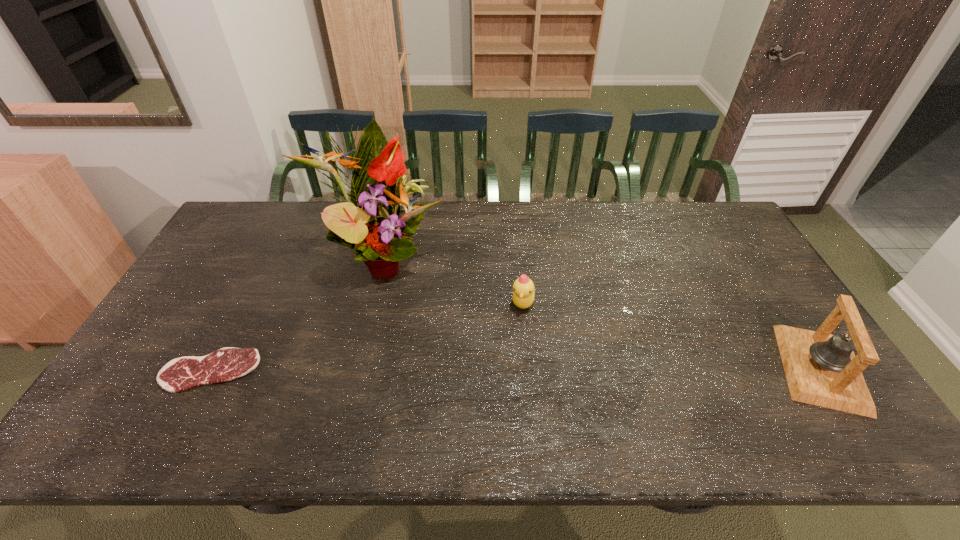
You are a GUI agent. You are given a task and a screenshot of the screen. Output one action in this format:
    pyautogui.click(x=<x>, y=<y>)
    Task: Click on the vacant spot on the desktop that is between the shortest object and the bell and is positioned on the front-facing side of the tallest object
    Image resolution: width=960 pixels, height=540 pixels.
    Given the screenshot: What is the action you would take?
    pyautogui.click(x=561, y=369)

This screenshot has width=960, height=540. I want to click on vacant spot on the desktop that is between the shortest object and the bell and is positioned on the front-facing side of the duckling, so click(x=540, y=369).